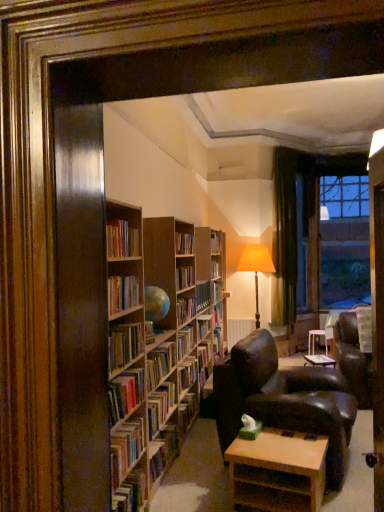
Question: Is wooden bookshelf at center, the 2th book viewed from the top, positioned before hardcover books at center, positioned as the 3th book in top-to-bottom order?

Choices:
 (A) yes
 (B) no

Answer: (A)

Question: Considering the relative sizes of wooden bookshelf at center, placed as the 4th book when sorted from bottom to top, and hardcover books at center, positioned as the 3th book in top-to-bottom order, in the image provided, is wooden bookshelf at center, placed as the 4th book when sorted from bottom to top, taller than hardcover books at center, positioned as the 3th book in top-to-bottom order,?

Choices:
 (A) yes
 (B) no

Answer: (B)

Question: Is wooden bookshelf at center, placed as the 4th book when sorted from bottom to top, in contact with hardcover books at center, positioned as the 3th book in top-to-bottom order?

Choices:
 (A) no
 (B) yes

Answer: (A)

Question: Is wooden bookshelf at center, the 2th book viewed from the top, outside of hardcover books at center, the third book positioned from the bottom?

Choices:
 (A) no
 (B) yes

Answer: (B)

Question: Is wooden bookshelf at center, the 2th book viewed from the top, further to camera compared to hardcover books at center, the third book positioned from the bottom?

Choices:
 (A) no
 (B) yes

Answer: (A)

Question: Is green velvet curtain at right wider or thinner than light brown wooden table at lower center?

Choices:
 (A) thin
 (B) wide

Answer: (A)

Question: Considering their positions, is green velvet curtain at right located in front of or behind light brown wooden table at lower center?

Choices:
 (A) behind
 (B) front

Answer: (A)

Question: Based on their sizes in the image, would you say green velvet curtain at right is bigger or smaller than light brown wooden table at lower center?

Choices:
 (A) small
 (B) big

Answer: (B)

Question: Is green velvet curtain at right spatially inside light brown wooden table at lower center, or outside of it?

Choices:
 (A) inside
 (B) outside

Answer: (B)

Question: Considering the positions of hardcover book at lower left, placed as the 1th book when sorted from bottom to top, and clear glass window at upper right in the image, is hardcover book at lower left, placed as the 1th book when sorted from bottom to top, taller or shorter than clear glass window at upper right?

Choices:
 (A) tall
 (B) short

Answer: (B)

Question: Looking at the image, does hardcover book at lower left, placed as the 1th book when sorted from bottom to top, seem bigger or smaller compared to clear glass window at upper right?

Choices:
 (A) small
 (B) big

Answer: (A)

Question: Is hardcover book at lower left, which is the fifth book from top to bottom, wider or thinner than clear glass window at upper right?

Choices:
 (A) wide
 (B) thin

Answer: (B)

Question: From the image's perspective, is hardcover book at lower left, which is the fifth book from top to bottom, above or below clear glass window at upper right?

Choices:
 (A) above
 (B) below

Answer: (B)

Question: From a real-world perspective, is light brown wooden table at lower center physically located above or below clear glass window at upper right?

Choices:
 (A) above
 (B) below

Answer: (B)

Question: Based on their positions, is light brown wooden table at lower center located to the left or right of clear glass window at upper right?

Choices:
 (A) right
 (B) left

Answer: (B)